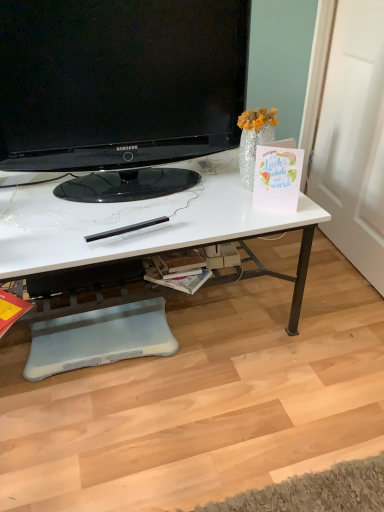
Where is `free spot above white paper magazine at center, acting as the 1th magazine starting from the right (from a real-world perspective)`? Image resolution: width=384 pixels, height=512 pixels. free spot above white paper magazine at center, acting as the 1th magazine starting from the right (from a real-world perspective) is located at coordinates (175, 275).